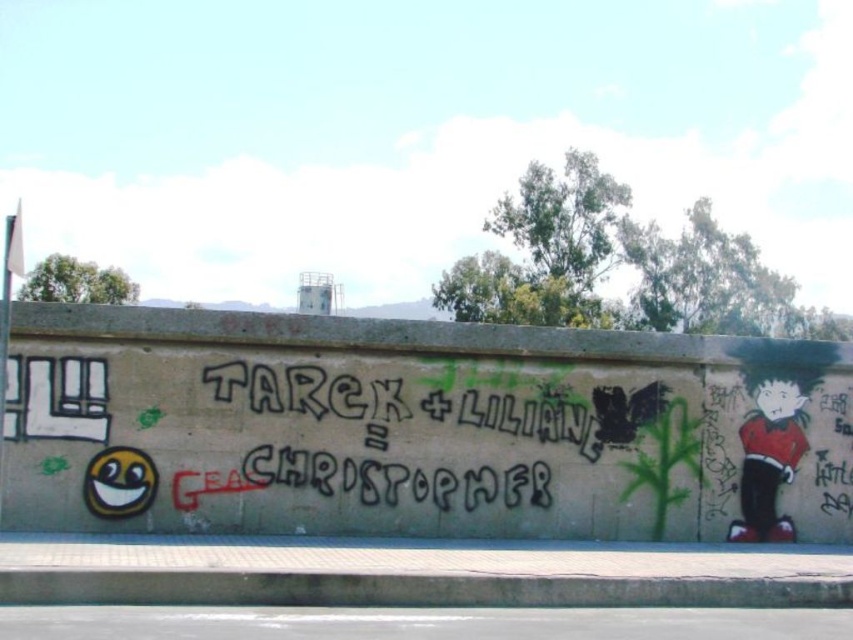
Can you confirm if black spray paint graffiti at center is positioned below red glossy skateboarder at right?

Incorrect, black spray paint graffiti at center is not positioned below red glossy skateboarder at right.

Which of these two, black spray paint graffiti at center or red glossy skateboarder at right, stands taller?

red glossy skateboarder at right

Which is in front, point (334, 396) or point (779, 465)?

Positioned in front is point (334, 396).

This screenshot has height=640, width=853. What are the coordinates of `black spray paint graffiti at center` in the screenshot? It's located at (398, 408).